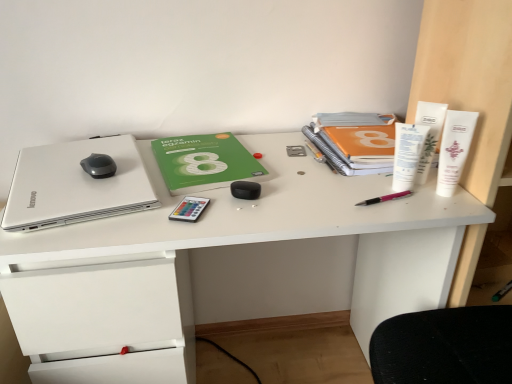
Locate an element on the screen. Image resolution: width=512 pixels, height=384 pixels. vacant space that is in between green matte paperback book at center, which is the second paperback book in right-to-left order, and white plastic tubes at right, the 3th stationery positioned from the right is located at coordinates (296, 172).